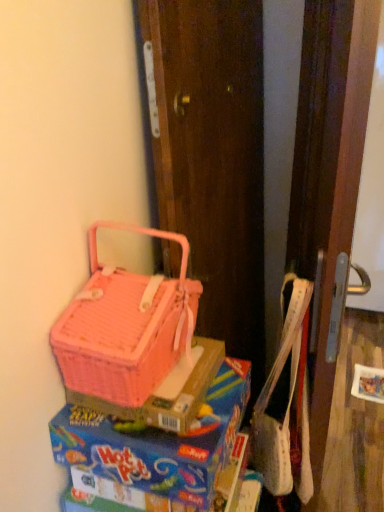
Question: From the image's perspective, is pink plastic lunch box at lower left below wooden screen door at right?

Choices:
 (A) yes
 (B) no

Answer: (A)

Question: Does pink plastic lunch box at lower left have a lesser width compared to wooden screen door at right?

Choices:
 (A) no
 (B) yes

Answer: (A)

Question: Is pink plastic lunch box at lower left further to camera compared to wooden screen door at right?

Choices:
 (A) no
 (B) yes

Answer: (A)

Question: From the image's perspective, is pink plastic lunch box at lower left on top of wooden screen door at right?

Choices:
 (A) yes
 (B) no

Answer: (B)

Question: Is pink plastic lunch box at lower left not near wooden screen door at right?

Choices:
 (A) no
 (B) yes

Answer: (A)

Question: Looking at their shapes, would you say pink wicker picnic basket at left is wider or thinner than wooden screen door at right?

Choices:
 (A) thin
 (B) wide

Answer: (B)

Question: Considering the positions of pink wicker picnic basket at left and wooden screen door at right in the image, is pink wicker picnic basket at left taller or shorter than wooden screen door at right?

Choices:
 (A) tall
 (B) short

Answer: (B)

Question: Is pink wicker picnic basket at left inside or outside of wooden screen door at right?

Choices:
 (A) inside
 (B) outside

Answer: (B)

Question: From the image's perspective, is pink wicker picnic basket at left above or below wooden screen door at right?

Choices:
 (A) above
 (B) below

Answer: (B)

Question: From a real-world perspective, is pink wicker basket at upper left positioned above or below wooden screen door at right?

Choices:
 (A) below
 (B) above

Answer: (B)

Question: Considering the positions of pink wicker basket at upper left and wooden screen door at right in the image, is pink wicker basket at upper left taller or shorter than wooden screen door at right?

Choices:
 (A) tall
 (B) short

Answer: (B)

Question: Which is correct: pink wicker basket at upper left is inside wooden screen door at right, or outside of it?

Choices:
 (A) outside
 (B) inside

Answer: (A)

Question: Looking at their shapes, would you say pink wicker basket at upper left is wider or thinner than wooden screen door at right?

Choices:
 (A) thin
 (B) wide

Answer: (B)

Question: Do you think pink wicker basket at upper left is within pink plastic lunch box at lower left, or outside of it?

Choices:
 (A) inside
 (B) outside

Answer: (B)

Question: Would you say pink wicker basket at upper left is to the left or to the right of pink plastic lunch box at lower left in the picture?

Choices:
 (A) left
 (B) right

Answer: (A)